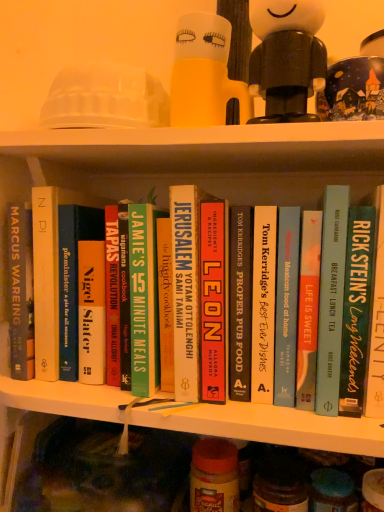
Where is `free location in front of green matte book at center, the 2th book positioned from the left`? The image size is (384, 512). free location in front of green matte book at center, the 2th book positioned from the left is located at coordinates (169, 401).